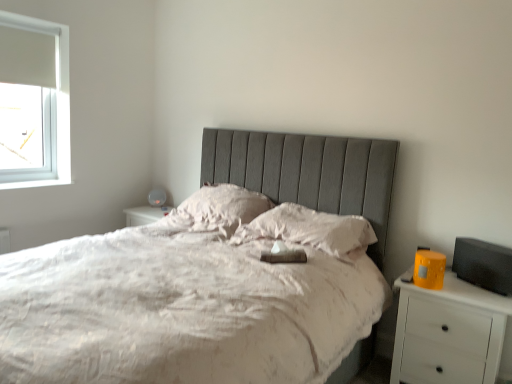
Describe the element at coordinates (448, 333) in the screenshot. This screenshot has width=512, height=384. I see `white matte nightstand at right` at that location.

This screenshot has width=512, height=384. What do you see at coordinates (220, 208) in the screenshot?
I see `white soft pillow at center, acting as the 2th pillow starting from the right` at bounding box center [220, 208].

The width and height of the screenshot is (512, 384). Find the location of `white soft pillow at center, acting as the 2th pillow starting from the right`. white soft pillow at center, acting as the 2th pillow starting from the right is located at coordinates (220, 208).

I want to click on matte gray table lamp at upper center, so pos(157,197).

I want to click on table lamp that is above the white matte nightstand at right (from the image's perspective), so click(x=157, y=197).

Considering the relative sizes of matte gray table lamp at upper center and white matte nightstand at right in the image provided, is matte gray table lamp at upper center thinner than white matte nightstand at right?

Yes.

From the image's perspective, is matte gray table lamp at upper center on white matte nightstand at right?

Indeed, from the image's perspective, matte gray table lamp at upper center is shown above white matte nightstand at right.

Is matte gray table lamp at upper center looking in the opposite direction of white matte nightstand at right?

That's not correct — matte gray table lamp at upper center is not looking away from white matte nightstand at right.

From a real-world perspective, is silky white pillow at center, placed as the 2th pillow when sorted from left to right, over matte gray table lamp at upper center?

Yes, from a real-world perspective, silky white pillow at center, placed as the 2th pillow when sorted from left to right, is on top of matte gray table lamp at upper center.

Is silky white pillow at center, placed as the 2th pillow when sorted from left to right, not close to matte gray table lamp at upper center?

silky white pillow at center, placed as the 2th pillow when sorted from left to right, is positioned a significant distance from matte gray table lamp at upper center.

What's the angular difference between silky white pillow at center, which appears as the 1th pillow when viewed from the right, and matte gray table lamp at upper center's facing directions?

The angular difference between silky white pillow at center, which appears as the 1th pillow when viewed from the right, and matte gray table lamp at upper center is 33.8 degrees.

Is silky white pillow at center, which appears as the 1th pillow when viewed from the right, located within white soft pillow at center, acting as the 2th pillow starting from the right?

No, silky white pillow at center, which appears as the 1th pillow when viewed from the right, is located outside of white soft pillow at center, acting as the 2th pillow starting from the right.

Could you tell me if white soft pillow at center, acting as the 2th pillow starting from the right, is facing silky white pillow at center, which appears as the 1th pillow when viewed from the right?

No, white soft pillow at center, acting as the 2th pillow starting from the right, is not oriented towards silky white pillow at center, which appears as the 1th pillow when viewed from the right.

Considering the relative sizes of white soft pillow at center, acting as the 2th pillow starting from the right, and silky white pillow at center, which appears as the 1th pillow when viewed from the right, in the image provided, is white soft pillow at center, acting as the 2th pillow starting from the right, bigger than silky white pillow at center, which appears as the 1th pillow when viewed from the right,?

Yes.

Does point (344, 236) come closer to viewer compared to point (471, 317)?

No, (344, 236) is further to viewer.

Can you confirm if silky white pillow at center, which appears as the 1th pillow when viewed from the right, is positioned to the right of white matte nightstand at right?

No.

From a real-world perspective, between silky white pillow at center, placed as the 2th pillow when sorted from left to right, and white matte nightstand at right, who is vertically lower?

white matte nightstand at right is physically lower.

Can you confirm if silky white pillow at center, placed as the 2th pillow when sorted from left to right, is shorter than white matte nightstand at right?

Yes, silky white pillow at center, placed as the 2th pillow when sorted from left to right, is shorter than white matte nightstand at right.

In the scene shown: Could you measure the distance between white matte nightstand at right and white soft pillow at center, which ranks as the 1th pillow in left-to-right order?

They are 1.25 meters apart.

Is white soft pillow at center, which ranks as the 1th pillow in left-to-right order, completely or partially inside white matte nightstand at right?

No, white soft pillow at center, which ranks as the 1th pillow in left-to-right order, is not inside white matte nightstand at right.

Which object is wider, white matte nightstand at right or white soft pillow at center, which ranks as the 1th pillow in left-to-right order?

With larger width is white soft pillow at center, which ranks as the 1th pillow in left-to-right order.

Can you confirm if white matte nightstand at right is positioned to the left of white soft pillow at center, acting as the 2th pillow starting from the right?

Incorrect, white matte nightstand at right is not on the left side of white soft pillow at center, acting as the 2th pillow starting from the right.

Considering the sizes of objects matte gray table lamp at upper center and white soft pillow at center, which ranks as the 1th pillow in left-to-right order, in the image provided, who is shorter, matte gray table lamp at upper center or white soft pillow at center, which ranks as the 1th pillow in left-to-right order,?

matte gray table lamp at upper center.

Does point (155, 196) come in front of point (246, 202)?

No, it is not.

In the image, is matte gray table lamp at upper center positioned in front of or behind white soft pillow at center, acting as the 2th pillow starting from the right?

Clearly, matte gray table lamp at upper center is behind white soft pillow at center, acting as the 2th pillow starting from the right.

Is matte gray table lamp at upper center positioned far away from white soft pillow at center, acting as the 2th pillow starting from the right?

Result: Indeed, matte gray table lamp at upper center is not near white soft pillow at center, acting as the 2th pillow starting from the right.

From the image's perspective, is matte gray table lamp at upper center under silky white pillow at center, which appears as the 1th pillow when viewed from the right?

No.

Between matte gray table lamp at upper center and silky white pillow at center, which appears as the 1th pillow when viewed from the right, which one has larger width?

Wider between the two is silky white pillow at center, which appears as the 1th pillow when viewed from the right.

How many degrees apart are the facing directions of matte gray table lamp at upper center and silky white pillow at center, which appears as the 1th pillow when viewed from the right?

There is a 33.8-degree angle between the facing directions of matte gray table lamp at upper center and silky white pillow at center, which appears as the 1th pillow when viewed from the right.

Considering the sizes of objects matte gray table lamp at upper center and silky white pillow at center, which appears as the 1th pillow when viewed from the right, in the image provided, who is bigger, matte gray table lamp at upper center or silky white pillow at center, which appears as the 1th pillow when viewed from the right,?

Bigger between the two is silky white pillow at center, which appears as the 1th pillow when viewed from the right.

Image resolution: width=512 pixels, height=384 pixels. Find the location of `nightstand below the matte gray table lamp at upper center (from a real-world perspective)`. nightstand below the matte gray table lamp at upper center (from a real-world perspective) is located at coordinates (448, 333).

From the image's perspective, starting from the matte gray table lamp at upper center, which pillow is the 2nd one below? Please provide its 2D coordinates.

[(311, 230)]

Estimate the real-world distances between objects in this image. Which object is closer to silky white pillow at center, placed as the 2th pillow when sorted from left to right, white soft pillow at center, acting as the 2th pillow starting from the right, or matte gray table lamp at upper center?

Based on the image, white soft pillow at center, acting as the 2th pillow starting from the right, appears to be nearer to silky white pillow at center, placed as the 2th pillow when sorted from left to right.

Considering their positions, is silky white pillow at center, placed as the 2th pillow when sorted from left to right, positioned further to white soft pillow at center, which ranks as the 1th pillow in left-to-right order, than white matte nightstand at right?

white matte nightstand at right is positioned further to the anchor white soft pillow at center, which ranks as the 1th pillow in left-to-right order.

In the scene shown: Which object lies further to the anchor point matte gray table lamp at upper center, white matte nightstand at right or white soft pillow at center, acting as the 2th pillow starting from the right?

white matte nightstand at right.

Estimate the real-world distances between objects in this image. Which object is further from silky white pillow at center, placed as the 2th pillow when sorted from left to right, white soft pillow at center, acting as the 2th pillow starting from the right, or white matte nightstand at right?

Based on the image, white matte nightstand at right appears to be further to silky white pillow at center, placed as the 2th pillow when sorted from left to right.

From the image, which object appears to be nearer to silky white pillow at center, placed as the 2th pillow when sorted from left to right, white matte nightstand at right or white soft pillow at center, which ranks as the 1th pillow in left-to-right order?

Based on the image, white soft pillow at center, which ranks as the 1th pillow in left-to-right order, appears to be nearer to silky white pillow at center, placed as the 2th pillow when sorted from left to right.

Based on the photo, which object lies further to the anchor point silky white pillow at center, which appears as the 1th pillow when viewed from the right, matte gray table lamp at upper center or white matte nightstand at right?

Among the two, matte gray table lamp at upper center is located further to silky white pillow at center, which appears as the 1th pillow when viewed from the right.

Looking at the image, which one is located closer to white matte nightstand at right, matte gray table lamp at upper center or white soft pillow at center, acting as the 2th pillow starting from the right?

white soft pillow at center, acting as the 2th pillow starting from the right, is closer to white matte nightstand at right.

From the image, which object appears to be nearer to white matte nightstand at right, white soft pillow at center, acting as the 2th pillow starting from the right, or matte gray table lamp at upper center?

Based on the image, white soft pillow at center, acting as the 2th pillow starting from the right, appears to be nearer to white matte nightstand at right.

At what (x,y) coordinates should I click in order to perform the action: click on pillow located between silky white pillow at center, placed as the 2th pillow when sorted from left to right, and matte gray table lamp at upper center in the depth direction. Please return your answer as a coordinate pair (x, y). Looking at the image, I should click on (220, 208).

Locate an element on the screen. pillow between white soft pillow at center, which ranks as the 1th pillow in left-to-right order, and white matte nightstand at right from left to right is located at coordinates click(x=311, y=230).